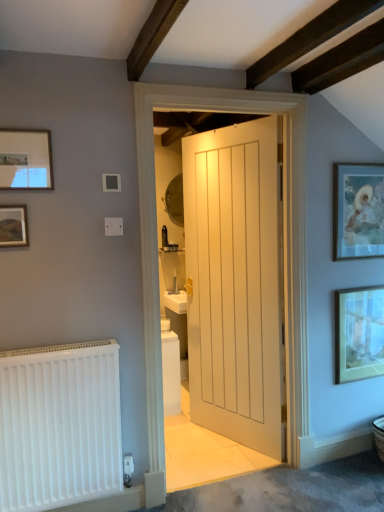
Locate an element on the screen. This screenshot has width=384, height=512. matte gold picture frame at right, the fourth picture frame positioned from the front is located at coordinates (359, 333).

The height and width of the screenshot is (512, 384). Describe the element at coordinates (358, 210) in the screenshot. I see `matte gold picture frame at upper right, positioned as the third picture frame in front-to-back order` at that location.

What do you see at coordinates (25, 159) in the screenshot?
I see `matte white picture frame at upper left, the fourth picture frame from the right` at bounding box center [25, 159].

Image resolution: width=384 pixels, height=512 pixels. What do you see at coordinates (13, 226) in the screenshot? I see `matte black picture frame at upper left, the 2th picture frame viewed from the front` at bounding box center [13, 226].

At what (x,y) coordinates should I click in order to perform the action: click on white matte radiator at lower left. Please return your answer as a coordinate pair (x, y). Looking at the image, I should click on (59, 425).

Identify the location of matte gold picture frame at right, which appears as the 4th picture frame when viewed from the left. The image size is (384, 512). (359, 333).

Which object is more forward, white painted wood door at center or matte gold picture frame at right, which is the 1th picture frame in right-to-left order?

white painted wood door at center is more forward.

From the image's perspective, which is below, white painted wood door at center or matte gold picture frame at right, which appears as the 4th picture frame when viewed from the left?

matte gold picture frame at right, which appears as the 4th picture frame when viewed from the left, appears lower in the image.

How distant is white painted wood door at center from matte gold picture frame at right, which appears as the 4th picture frame when viewed from the left?

white painted wood door at center and matte gold picture frame at right, which appears as the 4th picture frame when viewed from the left, are 24.81 inches apart.

From a real-world perspective, is white painted wood door at center physically located above or below matte gold picture frame at right, which is the 1th picture frame in right-to-left order?

In terms of real-world spatial position, white painted wood door at center is above matte gold picture frame at right, which is the 1th picture frame in right-to-left order.

Can you confirm if matte black picture frame at upper left, the second picture frame positioned from the left, is smaller than matte gold picture frame at upper right, which appears as the second picture frame when viewed from the back?

Correct, matte black picture frame at upper left, the second picture frame positioned from the left, occupies less space than matte gold picture frame at upper right, which appears as the second picture frame when viewed from the back.

Is the depth of matte black picture frame at upper left, the 3th picture frame from the right, less than that of matte gold picture frame at upper right, positioned as the third picture frame in front-to-back order?

Yes, the depth of matte black picture frame at upper left, the 3th picture frame from the right, is less than that of matte gold picture frame at upper right, positioned as the third picture frame in front-to-back order.

You are a GUI agent. You are given a task and a screenshot of the screen. Output one action in this format:
    pyautogui.click(x=<x>, y=<y>)
    Task: Click on the 1st picture frame above the matte black picture frame at upper left, the 2th picture frame viewed from the front (from the image's perspective)
    The height and width of the screenshot is (512, 384).
    Given the screenshot: What is the action you would take?
    pyautogui.click(x=358, y=210)

Which object is positioned more to the right, matte black picture frame at upper left, the 2th picture frame viewed from the front, or matte gold picture frame at upper right, which is the second picture frame in right-to-left order?

Positioned to the right is matte gold picture frame at upper right, which is the second picture frame in right-to-left order.

Are matte gold picture frame at upper right, the third picture frame in the left-to-right sequence, and white painted wood door at center located far from each other?

That's not correct — matte gold picture frame at upper right, the third picture frame in the left-to-right sequence, is a little close to white painted wood door at center.

Based on the photo, from the image's perspective, which one is positioned higher, matte gold picture frame at upper right, positioned as the third picture frame in front-to-back order, or white painted wood door at center?

From the image's view, matte gold picture frame at upper right, positioned as the third picture frame in front-to-back order, is above.

Does point (370, 231) appear closer or farther from the camera than point (233, 215)?

Point (370, 231) is positioned closer to the camera compared to point (233, 215).

In the scene shown: From a real-world perspective, is matte gold picture frame at upper right, the third picture frame in the left-to-right sequence, under white painted wood door at center?

No.

Is matte gold picture frame at right, arranged as the 1th picture frame when viewed from the back, taller than matte black picture frame at upper left, the third picture frame viewed from the back?

Yes, matte gold picture frame at right, arranged as the 1th picture frame when viewed from the back, is taller than matte black picture frame at upper left, the third picture frame viewed from the back.

Is matte gold picture frame at right, the fourth picture frame positioned from the front, directly adjacent to matte black picture frame at upper left, the 2th picture frame viewed from the front?

matte gold picture frame at right, the fourth picture frame positioned from the front, and matte black picture frame at upper left, the 2th picture frame viewed from the front, are clearly separated.

From a real-world perspective, is matte gold picture frame at right, which appears as the 4th picture frame when viewed from the left, located beneath matte black picture frame at upper left, the 2th picture frame viewed from the front?

Yes.

Considering the relative sizes of matte gold picture frame at right, arranged as the 1th picture frame when viewed from the back, and matte black picture frame at upper left, the second picture frame positioned from the left, in the image provided, is matte gold picture frame at right, arranged as the 1th picture frame when viewed from the back, thinner than matte black picture frame at upper left, the second picture frame positioned from the left,?

No, matte gold picture frame at right, arranged as the 1th picture frame when viewed from the back, is not thinner than matte black picture frame at upper left, the second picture frame positioned from the left.

From the image's perspective, relative to matte gold picture frame at upper right, the third picture frame in the left-to-right sequence, is matte white picture frame at upper left, the fourth picture frame from the right, above or below?

Based on their image positions, matte white picture frame at upper left, the fourth picture frame from the right, is located above matte gold picture frame at upper right, the third picture frame in the left-to-right sequence.

How far apart are matte white picture frame at upper left, the fourth picture frame from the right, and matte gold picture frame at upper right, which appears as the second picture frame when viewed from the back?

A distance of 5.43 feet exists between matte white picture frame at upper left, the fourth picture frame from the right, and matte gold picture frame at upper right, which appears as the second picture frame when viewed from the back.

Looking at this image, are matte white picture frame at upper left, the fourth picture frame from the right, and matte gold picture frame at upper right, positioned as the third picture frame in front-to-back order, making contact?

There is a gap between matte white picture frame at upper left, the fourth picture frame from the right, and matte gold picture frame at upper right, positioned as the third picture frame in front-to-back order.

Considering the positions of objects matte white picture frame at upper left, which appears as the first picture frame when viewed from the left, and matte gold picture frame at upper right, the third picture frame in the left-to-right sequence, in the image provided, who is behind, matte white picture frame at upper left, which appears as the first picture frame when viewed from the left, or matte gold picture frame at upper right, the third picture frame in the left-to-right sequence,?

matte gold picture frame at upper right, the third picture frame in the left-to-right sequence, is further from the camera.

Is white painted wood door at center to the left or to the right of matte gold picture frame at upper right, which appears as the second picture frame when viewed from the back, in the image?

Based on their positions, white painted wood door at center is located to the left of matte gold picture frame at upper right, which appears as the second picture frame when viewed from the back.

What's the angular difference between white painted wood door at center and matte gold picture frame at upper right, which is the second picture frame in right-to-left order,'s facing directions?

white painted wood door at center and matte gold picture frame at upper right, which is the second picture frame in right-to-left order, are facing 64.7 degrees away from each other.

Can matte gold picture frame at upper right, the third picture frame in the left-to-right sequence, be found inside white painted wood door at center?

No, matte gold picture frame at upper right, the third picture frame in the left-to-right sequence, is not inside white painted wood door at center.

Image resolution: width=384 pixels, height=512 pixels. Find the location of `the 1st picture frame behind when counting from the white painted wood door at center`. the 1st picture frame behind when counting from the white painted wood door at center is located at coordinates (358, 210).

How many degrees apart are the facing directions of white matte radiator at lower left and white painted wood door at center?

They differ by 64.7 degrees in their facing directions.

From the image's perspective, is white matte radiator at lower left located beneath white painted wood door at center?

Indeed, from the image's perspective, white matte radiator at lower left is shown beneath white painted wood door at center.

Considering the sizes of white matte radiator at lower left and white painted wood door at center in the image, is white matte radiator at lower left taller or shorter than white painted wood door at center?

Clearly, white matte radiator at lower left is shorter compared to white painted wood door at center.

Where is `door above the matte gold picture frame at right, the fourth picture frame positioned from the front (from a real-world perspective)`? Image resolution: width=384 pixels, height=512 pixels. door above the matte gold picture frame at right, the fourth picture frame positioned from the front (from a real-world perspective) is located at coordinates (236, 282).

There is a matte black picture frame at upper left, the 2th picture frame viewed from the front. Identify the location of the 1st picture frame above it (from the image's perspective). (358, 210).

Which object lies nearer to the anchor point matte black picture frame at upper left, the second picture frame positioned from the left, matte white picture frame at upper left, which appears as the first picture frame when viewed from the left, or matte gold picture frame at upper right, which appears as the second picture frame when viewed from the back?

matte white picture frame at upper left, which appears as the first picture frame when viewed from the left, is positioned closer to the anchor matte black picture frame at upper left, the second picture frame positioned from the left.

Which object lies nearer to the anchor point matte gold picture frame at upper right, the third picture frame in the left-to-right sequence, matte black picture frame at upper left, the 3th picture frame from the right, or white painted wood door at center?

white painted wood door at center.

Based on their spatial positions, is matte gold picture frame at right, which is the 1th picture frame in right-to-left order, or matte white picture frame at upper left, the fourth picture frame from the right, further from matte gold picture frame at upper right, which appears as the second picture frame when viewed from the back?

matte white picture frame at upper left, the fourth picture frame from the right.

Estimate the real-world distances between objects in this image. Which object is further from matte gold picture frame at right, arranged as the 1th picture frame when viewed from the back, matte gold picture frame at upper right, the third picture frame in the left-to-right sequence, or white painted wood door at center?

white painted wood door at center.

Consider the image. When comparing their distances from white matte radiator at lower left, does matte black picture frame at upper left, the second picture frame positioned from the left, or matte gold picture frame at right, the fourth picture frame positioned from the front, seem further?

Among the two, matte gold picture frame at right, the fourth picture frame positioned from the front, is located further to white matte radiator at lower left.

When comparing their distances from matte gold picture frame at right, which is the 1th picture frame in right-to-left order, does matte black picture frame at upper left, the third picture frame viewed from the back, or matte white picture frame at upper left, which is counted as the fourth picture frame, starting from the back, seem further?

matte black picture frame at upper left, the third picture frame viewed from the back.

Estimate the real-world distances between objects in this image. Which object is further from matte gold picture frame at upper right, the third picture frame in the left-to-right sequence, white matte radiator at lower left or matte black picture frame at upper left, the 2th picture frame viewed from the front?

Based on the image, matte black picture frame at upper left, the 2th picture frame viewed from the front, appears to be further to matte gold picture frame at upper right, the third picture frame in the left-to-right sequence.

Considering their positions, is white painted wood door at center positioned further to matte black picture frame at upper left, the second picture frame positioned from the left, than matte gold picture frame at right, the fourth picture frame positioned from the front?

matte gold picture frame at right, the fourth picture frame positioned from the front, is positioned further to the anchor matte black picture frame at upper left, the second picture frame positioned from the left.

This screenshot has height=512, width=384. In order to click on picture frame between white painted wood door at center and matte gold picture frame at right, the fourth picture frame positioned from the front, from left to right in this screenshot , I will do `click(358, 210)`.

Where is `door located between matte black picture frame at upper left, the 3th picture frame from the right, and matte gold picture frame at upper right, which appears as the second picture frame when viewed from the back, in the left-right direction`? door located between matte black picture frame at upper left, the 3th picture frame from the right, and matte gold picture frame at upper right, which appears as the second picture frame when viewed from the back, in the left-right direction is located at coordinates (236, 282).

What are the coordinates of `picture frame between matte white picture frame at upper left, which is counted as the fourth picture frame, starting from the back, and white painted wood door at center from left to right` in the screenshot? It's located at (13, 226).

The height and width of the screenshot is (512, 384). In order to click on door located between white matte radiator at lower left and matte gold picture frame at upper right, positioned as the third picture frame in front-to-back order, in the left-right direction in this screenshot , I will do `click(236, 282)`.